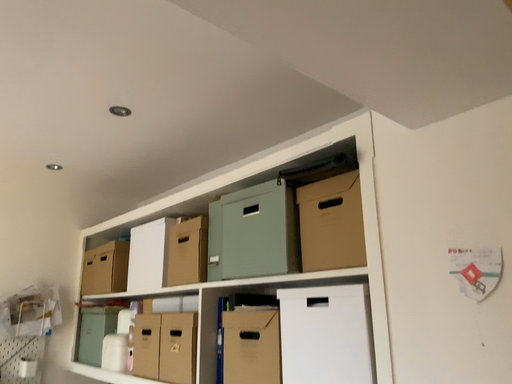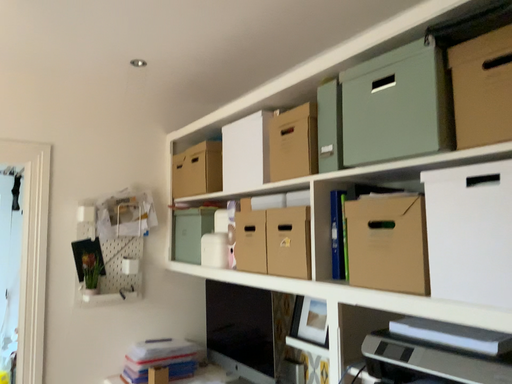
Question: How did the camera likely rotate when shooting the video?

Choices:
 (A) rotated upward
 (B) rotated downward

Answer: (B)